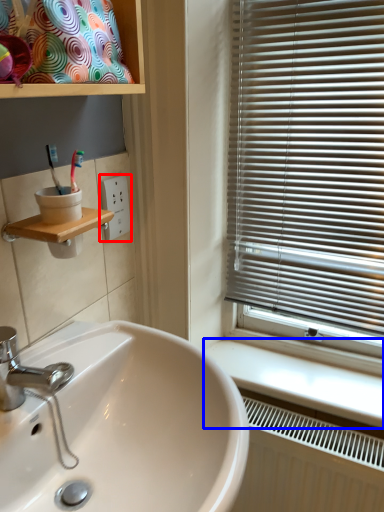
Question: Which object is closer to the camera taking this photo, electric outlet (highlighted by a red box) or counter top (highlighted by a blue box)?

Choices:
 (A) electric outlet
 (B) counter top

Answer: (B)